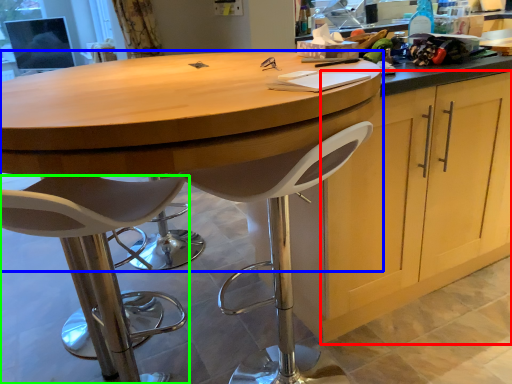
Question: Which object is the farthest from cabinetry (highlighted by a red box)? Choose among these: table (highlighted by a blue box) or chair (highlighted by a green box).

Choices:
 (A) table
 (B) chair

Answer: (B)